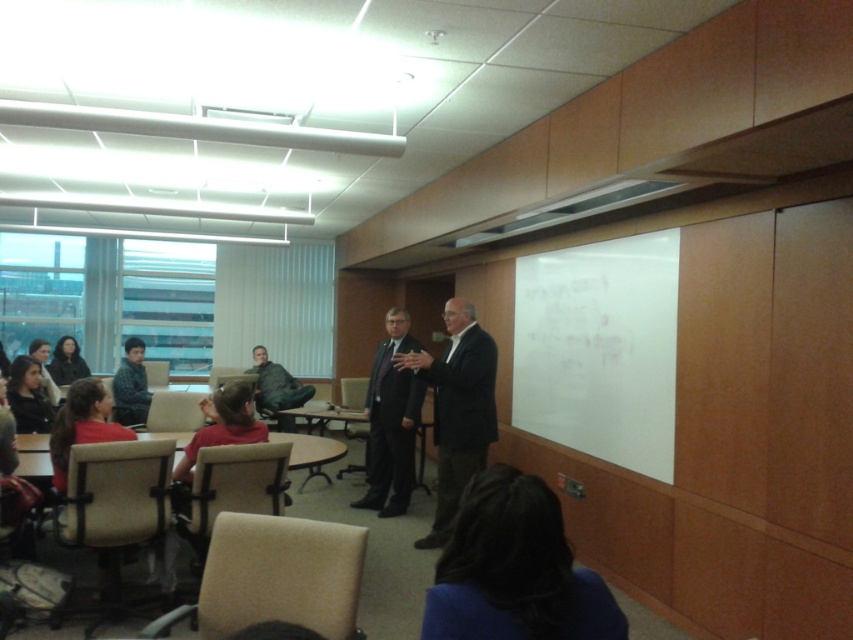
You are a photographer trying to capture a closeup of the speaker in the room. You notice the dark brown hair at lower center and the dark gray fabric jacket at center. Which object should you focus on to ensure the speaker is fully visible in the photo?

You should focus on the dark gray fabric jacket at center because it occupies more space than the dark brown hair at lower center, ensuring the speaker is fully visible.

You are sitting at one of the round tables in the classroom and want to take a photo of the speaker wearing the dark gray suit at center. Based on your position, can you determine if the speaker is directly in front of you or to one side?

The dark gray suit at center is located at point coordinates indicating it is positioned centrally in the room. Since you are sitting at a round table facing the front, the speaker should be directly in front of you.